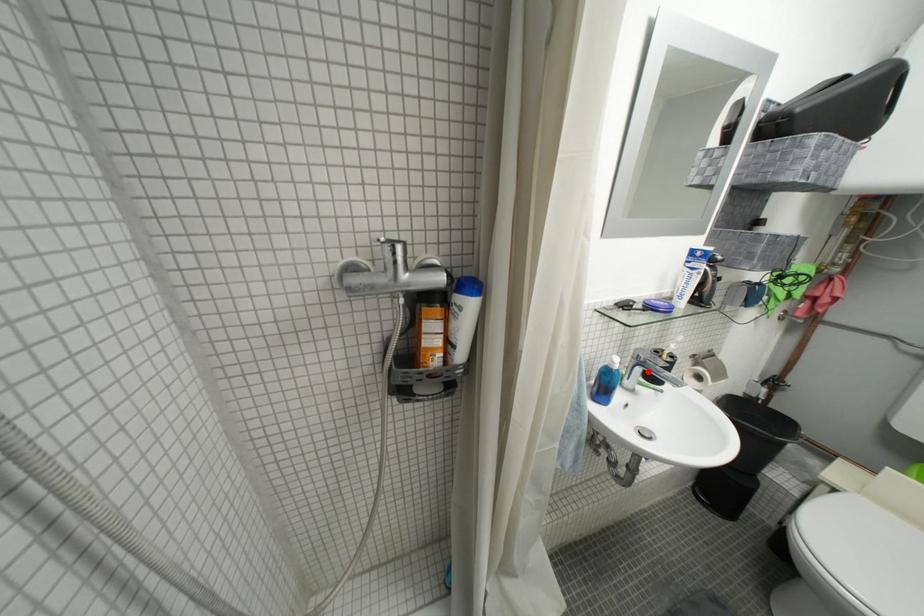
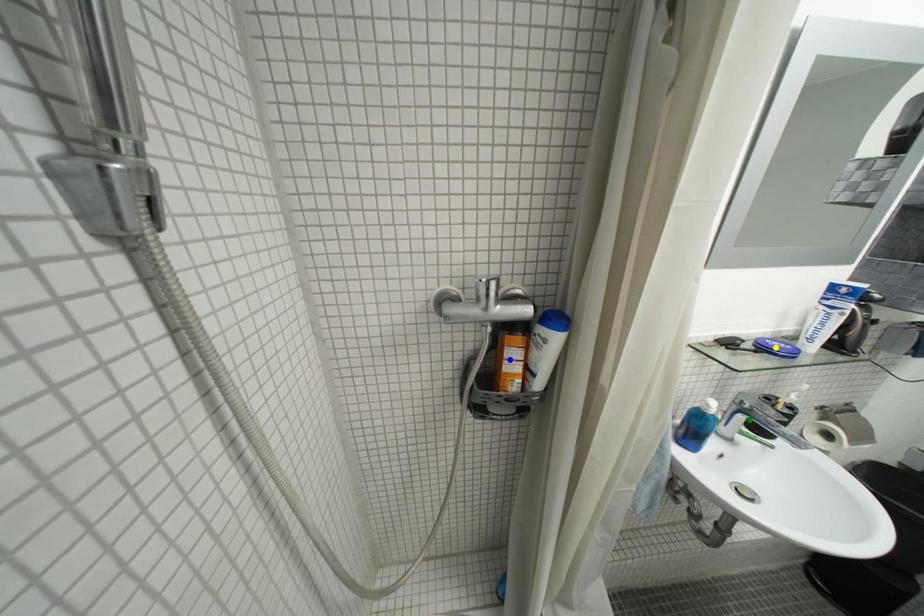
Question: I am providing you with two images of the same scene from different viewpoints. A red point is marked on the first image. You are given multiple points on the second image. Which mark in image 2 goes with the point in image 1?

Choices:
 (A) yellow point
 (B) blue point
 (C) green point

Answer: (C)